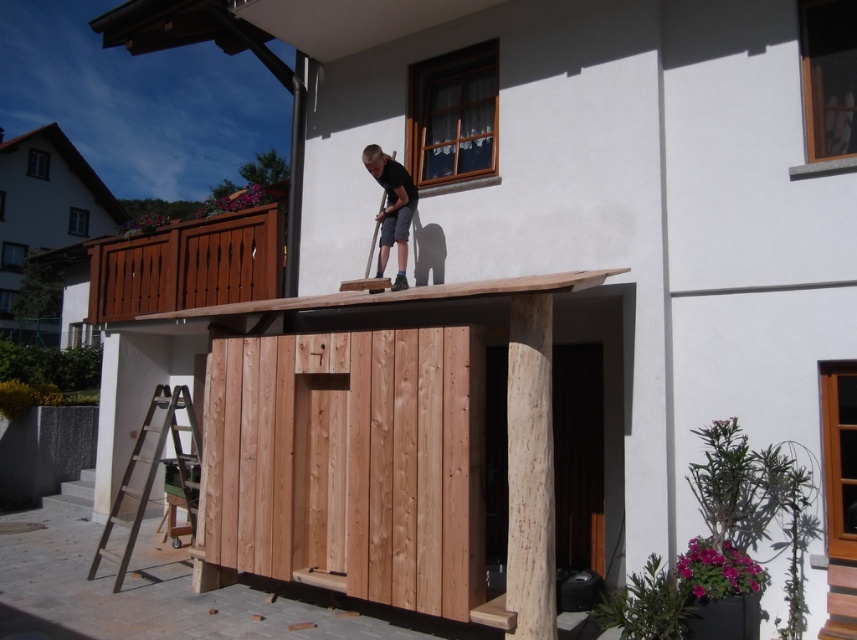
Looking at this image, can you confirm if smooth reddish-brown wood at upper center is positioned above brown wooden ladder at lower left?

Correct, smooth reddish-brown wood at upper center is located above brown wooden ladder at lower left.

The image size is (857, 640). Describe the element at coordinates (189, 264) in the screenshot. I see `smooth reddish-brown wood at upper center` at that location.

Is point (273, 291) closer to camera compared to point (174, 449)?

That is False.

Find the location of a particular element. The height and width of the screenshot is (640, 857). smooth reddish-brown wood at upper center is located at coordinates (189, 264).

Does smooth reddish-brown wood at upper center lie behind brown wooden hut at left?

No.

Does smooth reddish-brown wood at upper center have a smaller size compared to brown wooden hut at left?

Yes.

Who is more distant from viewer, (180, 260) or (70, 150)?

Point (70, 150)

This screenshot has height=640, width=857. In order to click on smooth reddish-brown wood at upper center in this screenshot , I will do `click(189, 264)`.

Does brown wooden ladder at lower left have a larger size compared to matte black shirt at upper center?

Correct, brown wooden ladder at lower left is larger in size than matte black shirt at upper center.

Is point (178, 465) more distant than point (393, 225)?

Yes, point (178, 465) is farther from viewer.

Image resolution: width=857 pixels, height=640 pixels. Find the location of `brown wooden ladder at lower left`. brown wooden ladder at lower left is located at coordinates (154, 470).